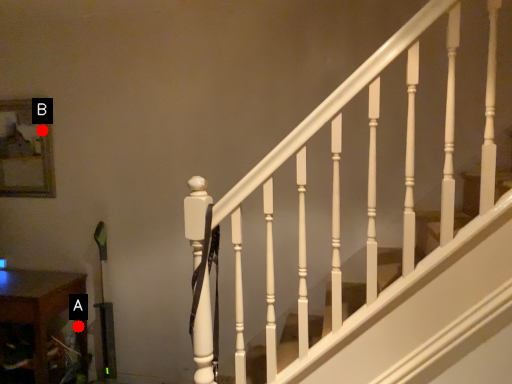
Question: Two points are circled on the image, labeled by A and B beside each circle. Which point is further to the camera?

Choices:
 (A) A is further
 (B) B is further

Answer: (B)